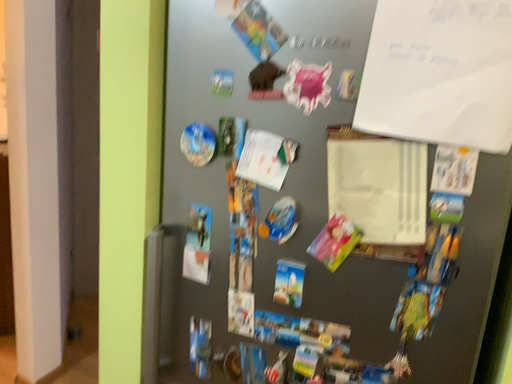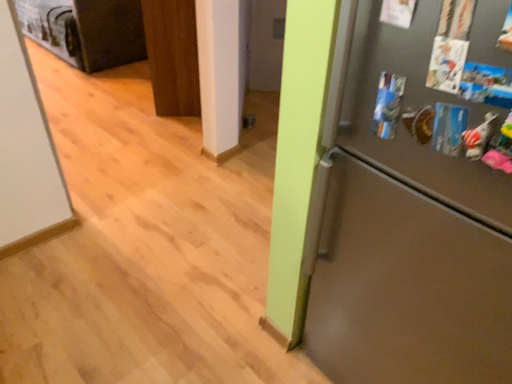
Question: Which way did the camera rotate in the video?

Choices:
 (A) rotated downward
 (B) rotated upward

Answer: (A)